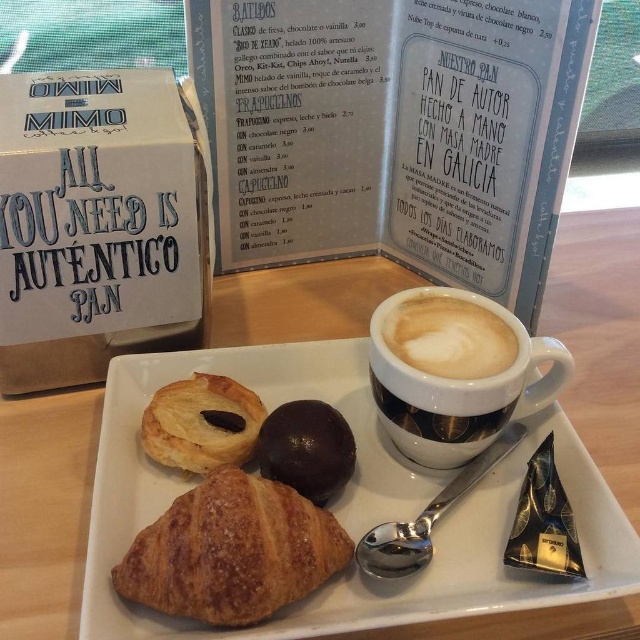
You are a customer at the cafe and want to grab the shiny chocolate truffle at center without touching the matte ceramic cup at center. Is it possible to do so?

The matte ceramic cup at center is positioned on the right side of the shiny chocolate truffle at center, so there is space to the left of the shiny chocolate truffle at center to grab it without touching the cup.

You are a barista who needs to place a 5 inch wide cake on the table between the golden brown croissant at center and the matte ceramic cup at center. Is there enough space between them to fit the cake?

The distance between the golden brown croissant at center and the matte ceramic cup at center is 4.94 inches. Since the cake is 5 inches wide, there isn not enough space to fit it between them.

You are a barista trying to place both the matte ceramic cup at center and the shiny chocolate truffle at center on a shelf that can only hold items up to 15 cm in height. According to the scene description, which item is more likely to exceed the shelf height limit?

The matte ceramic cup at center is much taller than the shiny chocolate truffle at center, so it is more likely to exceed the shelf height limit of 15 cm.